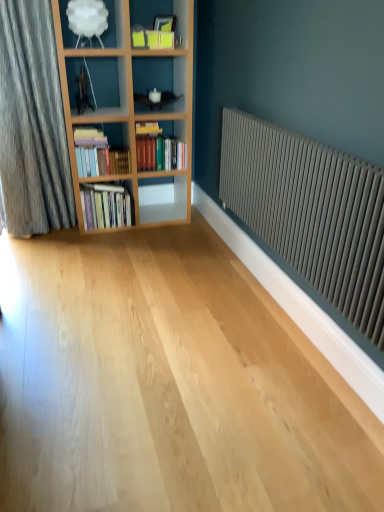
What are the coordinates of `free region under matte gray radiator at right (from a real-world perspective)` in the screenshot? It's located at (295, 338).